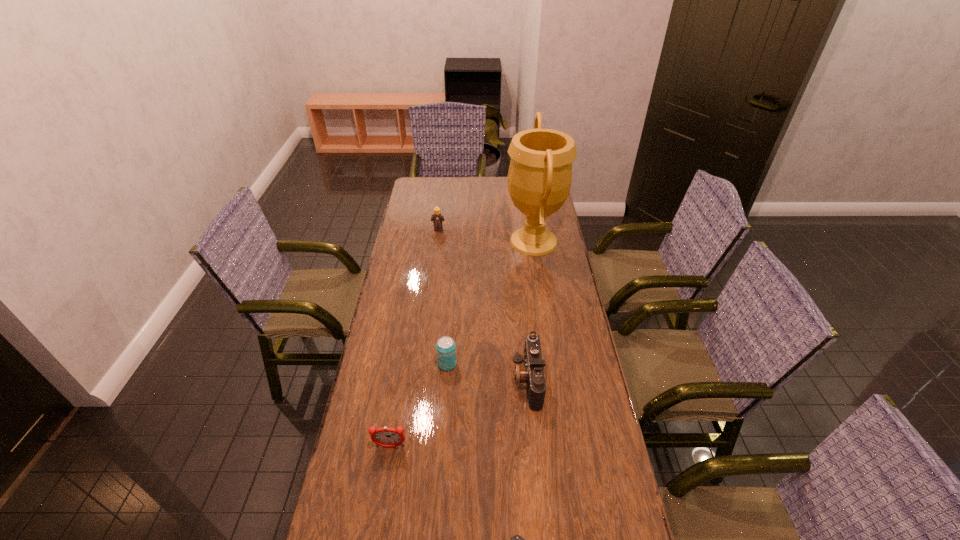
Identify the location of vacant space at the far left corner. The width and height of the screenshot is (960, 540). (427, 180).

Image resolution: width=960 pixels, height=540 pixels. I want to click on empty space that is in between the alarm clock and the tallest object, so click(x=462, y=344).

I want to click on free space that is in between the beer can and the tallest object, so click(x=491, y=302).

Where is `free space between the beer can and the Lego`? free space between the beer can and the Lego is located at coordinates (443, 296).

The height and width of the screenshot is (540, 960). Find the location of `free space between the Lego and the third object from left to right`. free space between the Lego and the third object from left to right is located at coordinates (443, 296).

At what (x,y) coordinates should I click in order to perform the action: click on free space between the Lego and the third object from left to right. Please return your answer as a coordinate pair (x, y). This screenshot has width=960, height=540. Looking at the image, I should click on (443, 296).

Image resolution: width=960 pixels, height=540 pixels. I want to click on vacant area that lies between the third object from left to right and the second nearest object, so click(419, 406).

The image size is (960, 540). In order to click on empty space between the fifth farthest object and the trophy in this screenshot , I will do `click(462, 344)`.

Image resolution: width=960 pixels, height=540 pixels. What are the coordinates of `empty space that is in between the beer can and the Lego` in the screenshot? It's located at (443, 296).

The height and width of the screenshot is (540, 960). I want to click on object identified as the fourth closest to the fourth object from right to left, so click(517, 539).